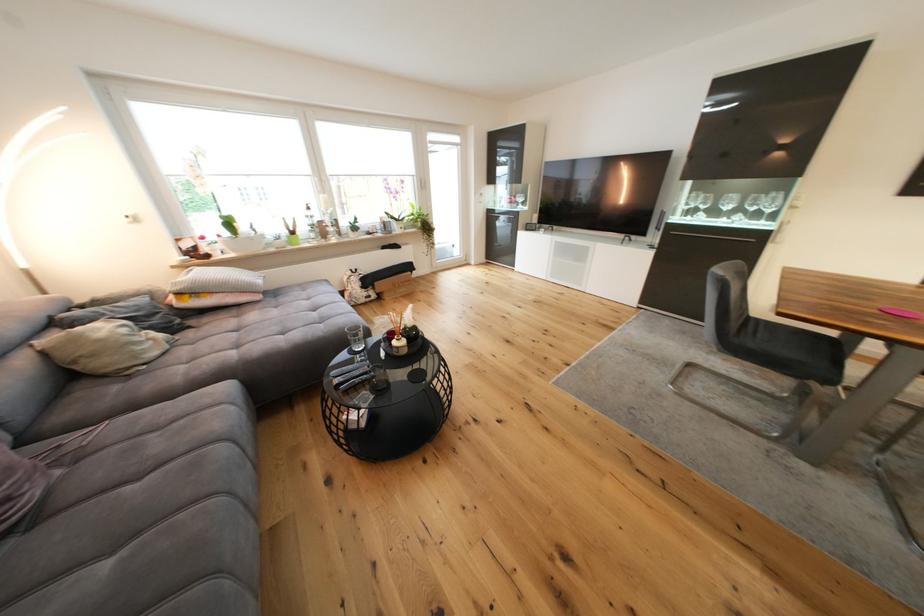
Describe the element at coordinates (791, 350) in the screenshot. I see `the chair sitting surface` at that location.